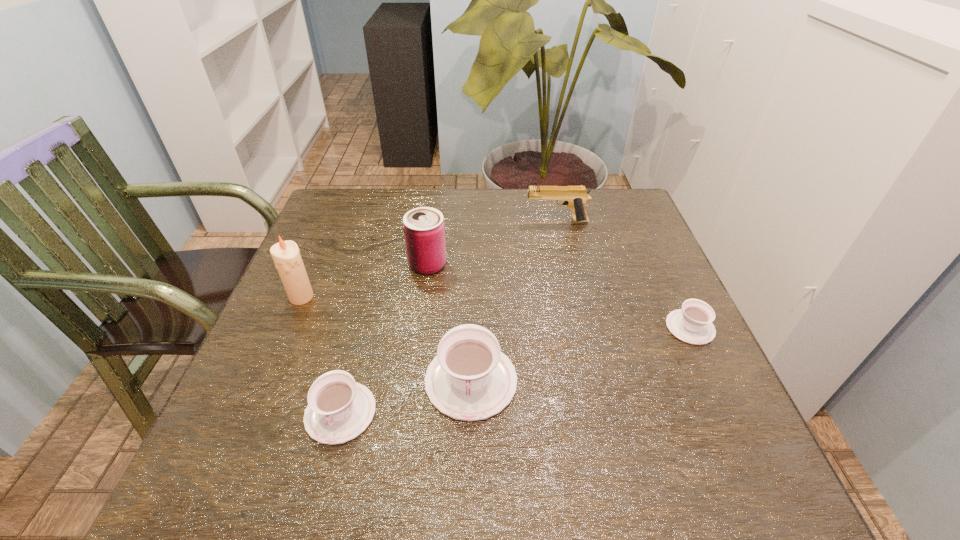
The height and width of the screenshot is (540, 960). In order to click on blank area in the image that satisfies the following two spatial constraints: 1. at the barrel of the farthest object; 2. on the handle side of the second teacup from right to left in this screenshot , I will do `click(592, 381)`.